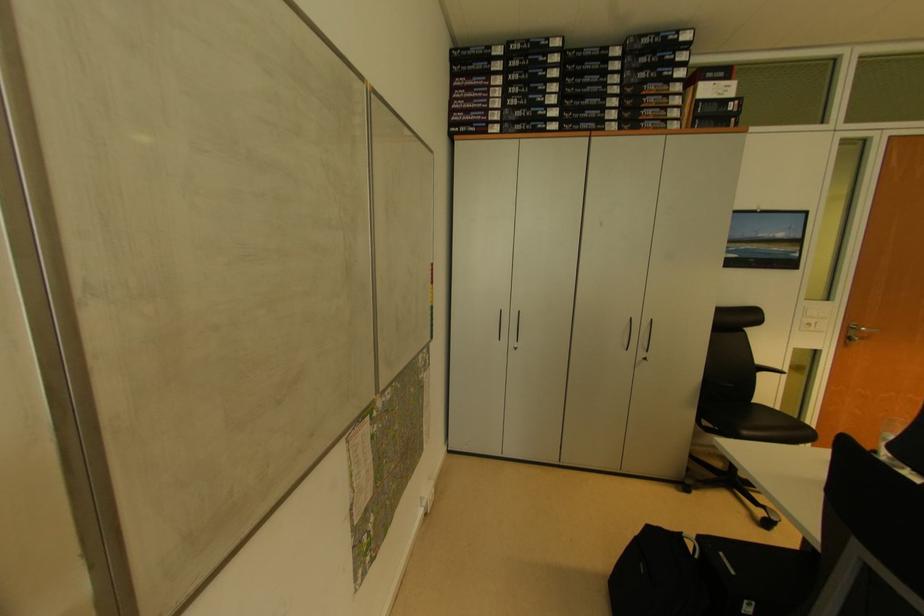
The image size is (924, 616). Identify the location of chair armrest. (794, 363).